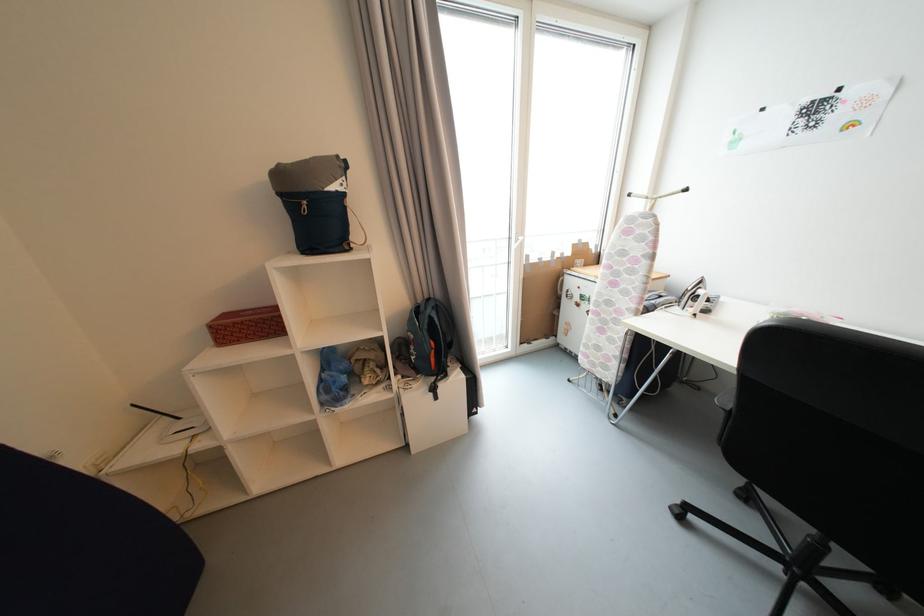
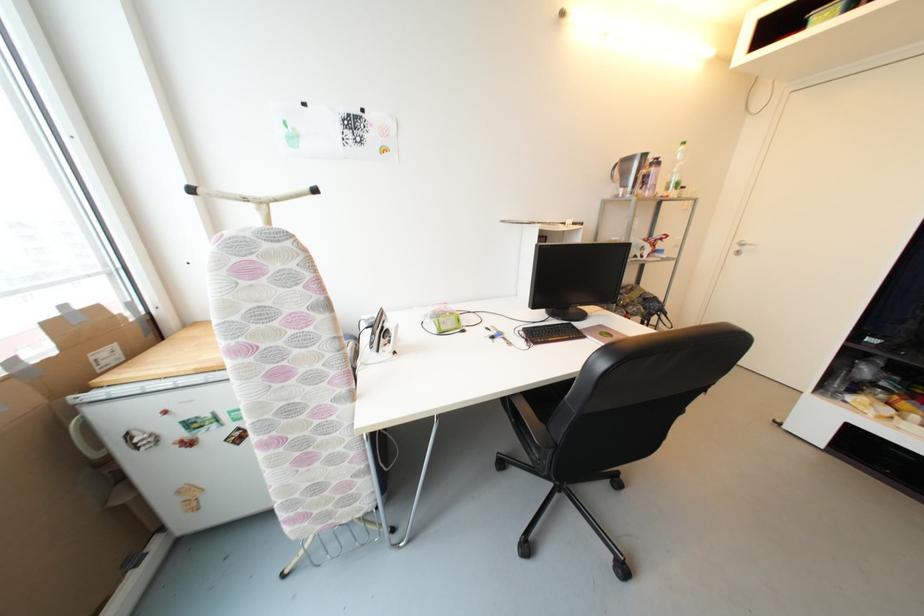
Where in the second image is the point corresponding to the point at 706,294 from the first image?

(393, 328)